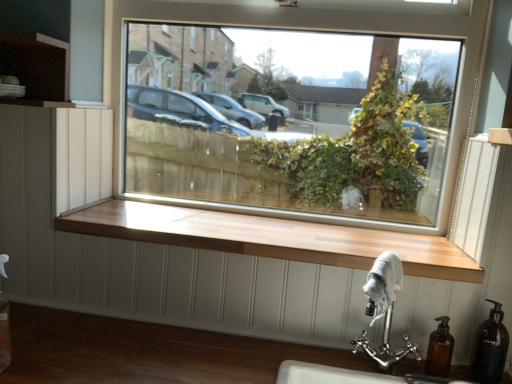
Question: Visually, is translucent brown soap dispenser at lower right, the second soap dispenser from the left, positioned to the left or to the right of transparent glass window at center?

Choices:
 (A) left
 (B) right

Answer: (B)

Question: Is translucent brown soap dispenser at lower right, which is the first soap dispenser in right-to-left order, wider or thinner than transparent glass window at center?

Choices:
 (A) wide
 (B) thin

Answer: (B)

Question: Estimate the real-world distances between objects in this image. Which object is farther from the translucent brown soap dispenser at lower right, the second soap dispenser from the left?

Choices:
 (A) wooden at center
 (B) brown matte soap dispenser at lower right, the 1th soap dispenser positioned from the left
 (C) polished chrome sink at lower right
 (D) transparent glass window at center

Answer: (D)

Question: Which object is positioned closest to the wooden at center?

Choices:
 (A) polished chrome sink at lower right
 (B) translucent brown soap dispenser at lower right, the second soap dispenser from the left
 (C) brown matte soap dispenser at lower right, the 2th soap dispenser when ordered from right to left
 (D) transparent glass window at center

Answer: (A)